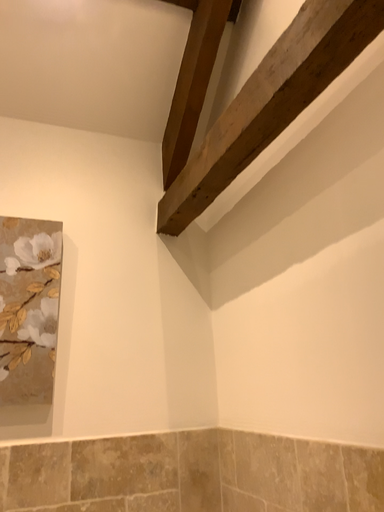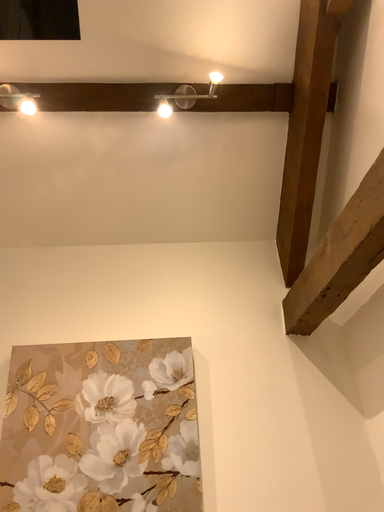
Question: How did the camera likely rotate when shooting the video?

Choices:
 (A) rotated upward
 (B) rotated downward

Answer: (A)